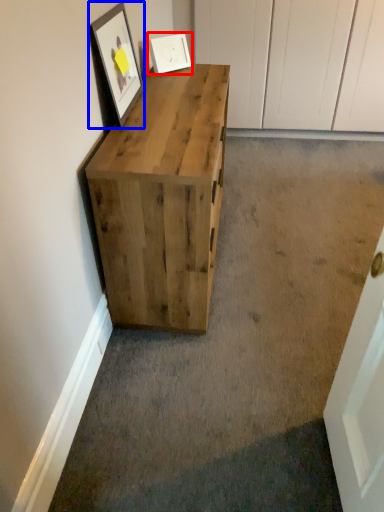
Question: Which of the following is the farthest to the observer, picture frame (highlighted by a red box) or picture frame (highlighted by a blue box)?

Choices:
 (A) picture frame
 (B) picture frame

Answer: (A)